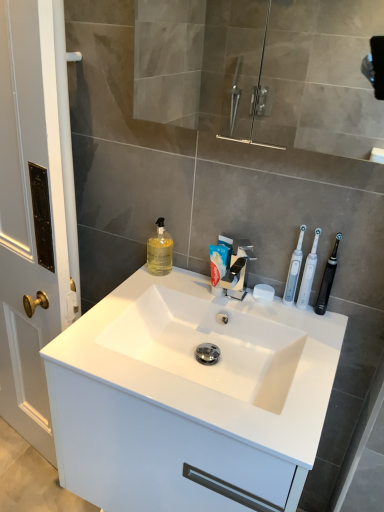
The image size is (384, 512). What are the coordinates of `vacant area that lies between translucent yellow liquid at sink left and black plastic toothbrush at right, which is the first toothbrush in right-to-left order` in the screenshot? It's located at (212, 285).